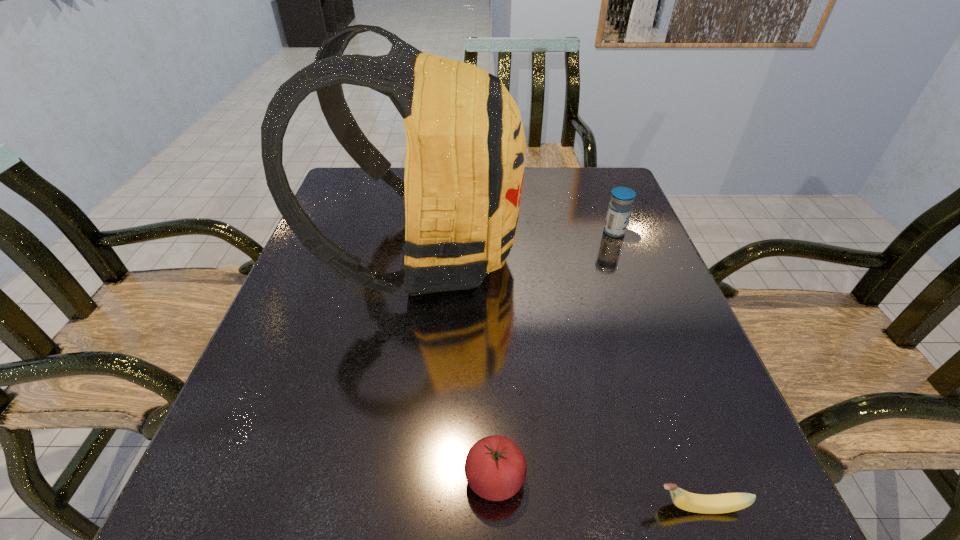
Locate an element on the screen. The image size is (960, 540). object located in the far edge section of the desktop is located at coordinates (465, 150).

Locate an element on the screen. The height and width of the screenshot is (540, 960). tomato that is at the near edge is located at coordinates (495, 468).

I want to click on banana located in the near edge section of the desktop, so click(728, 502).

Locate an element on the screen. Image resolution: width=960 pixels, height=540 pixels. object that is positioned at the left edge is located at coordinates (465, 150).

Locate an element on the screen. The width and height of the screenshot is (960, 540). medicine that is at the right edge is located at coordinates (619, 210).

Image resolution: width=960 pixels, height=540 pixels. Find the location of `banana located in the right edge section of the desktop`. banana located in the right edge section of the desktop is located at coordinates (728, 502).

I want to click on object situated at the far left corner, so click(x=465, y=150).

Image resolution: width=960 pixels, height=540 pixels. Find the location of `object situated at the near right corner`. object situated at the near right corner is located at coordinates (728, 502).

This screenshot has height=540, width=960. In the image, there is a desktop. In order to click on free space at the far edge in this screenshot , I will do `click(548, 190)`.

You are a GUI agent. You are given a task and a screenshot of the screen. Output one action in this format:
    pyautogui.click(x=<x>, y=<y>)
    Task: Click on the vacant space at the near edge of the desktop
    Image resolution: width=960 pixels, height=540 pixels.
    Given the screenshot: What is the action you would take?
    pyautogui.click(x=457, y=503)